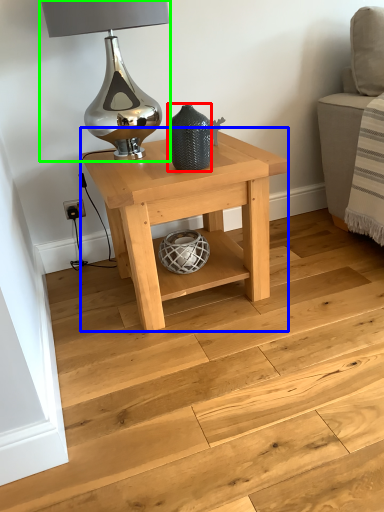
Question: Estimate the real-world distances between objects in this image. Which object is closer to vase (highlighted by a red box), table (highlighted by a blue box) or table lamp (highlighted by a green box)?

Choices:
 (A) table
 (B) table lamp

Answer: (A)